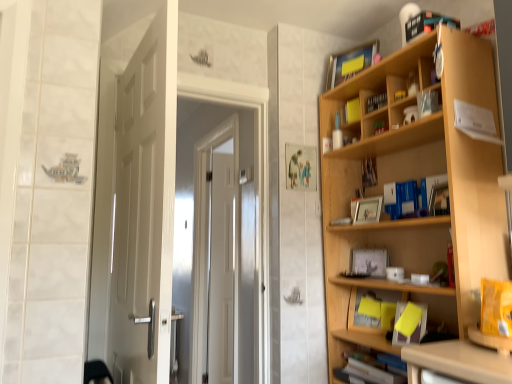
You are a GUI agent. You are given a task and a screenshot of the screen. Output one action in this format:
    pyautogui.click(x=<x>, y=<y>)
    Task: Click on the yellow paper at lower right, marked as the first book in a bottom-to-top arrangement
    
    Given the screenshot: What is the action you would take?
    pyautogui.click(x=373, y=311)

Image resolution: width=512 pixels, height=384 pixels. What do you see at coordinates (496, 307) in the screenshot?
I see `yellow paper at lower right, the ninth book from the top` at bounding box center [496, 307].

Image resolution: width=512 pixels, height=384 pixels. Identify the location of matte yellow book at upper right, the second book viewed from the top. (350, 63).

In order to face matte plastic book at upper right, which appears as the sixth book when ordered from the bottom, should I rotate leftwards or rightwards?

You should look right and rotate roughly 22.225 degrees.

Find the location of a particular element. Image resolution: width=512 pixels, height=384 pixels. yellow matte bookshelf at upper center, arranged as the 7th book when ordered from the bottom is located at coordinates (352, 110).

What do you see at coordinates (369, 172) in the screenshot? I see `wooden photo frame at upper right, positioned as the 8th book in top-to-bottom order` at bounding box center [369, 172].

Where is `wooden photo frame at upper right, positioned as the 8th book in top-to-bottom order`? wooden photo frame at upper right, positioned as the 8th book in top-to-bottom order is located at coordinates (369, 172).

Identify the location of yellow paper at lower right, marked as the first book in a bottom-to-top arrangement. The width and height of the screenshot is (512, 384). (373, 311).

From the image's perspective, would you say yellow matte bookshelf at upper center, arranged as the 7th book when ordered from the bottom, is positioned over green matte bookshelf at upper center, marked as the 5th book in a bottom-to-top arrangement?

Correct, yellow matte bookshelf at upper center, arranged as the 7th book when ordered from the bottom, appears higher than green matte bookshelf at upper center, marked as the 5th book in a bottom-to-top arrangement, in the image.

From the picture: Who is bigger, yellow matte bookshelf at upper center, arranged as the 7th book when ordered from the bottom, or green matte bookshelf at upper center, placed as the sixth book when sorted from top to bottom?

yellow matte bookshelf at upper center, arranged as the 7th book when ordered from the bottom.

Is yellow matte bookshelf at upper center, the fourth book when ordered from top to bottom, inside or outside of green matte bookshelf at upper center, marked as the 5th book in a bottom-to-top arrangement?

yellow matte bookshelf at upper center, the fourth book when ordered from top to bottom, is located beyond the bounds of green matte bookshelf at upper center, marked as the 5th book in a bottom-to-top arrangement.

How different are the orientations of yellow matte bookshelf at upper center, the fourth book when ordered from top to bottom, and green matte bookshelf at upper center, placed as the sixth book when sorted from top to bottom, in degrees?

17.7 degrees separate the facing orientations of yellow matte bookshelf at upper center, the fourth book when ordered from top to bottom, and green matte bookshelf at upper center, placed as the sixth book when sorted from top to bottom.

Which point is more forward, (437, 91) or (341, 341)?

The point (437, 91) is more forward.

Consider the image. From a real-world perspective, who is located higher, matte plastic book at upper right, arranged as the fifth book when viewed from the top, or light wood bookcase at right?

matte plastic book at upper right, arranged as the fifth book when viewed from the top, from a real-world perspective.

Based on their sizes in the image, would you say matte plastic book at upper right, arranged as the fifth book when viewed from the top, is bigger or smaller than light wood bookcase at right?

Clearly, matte plastic book at upper right, arranged as the fifth book when viewed from the top, is smaller in size than light wood bookcase at right.

Measure the distance from matte plastic book at upper right, arranged as the fifth book when viewed from the top, to light wood bookcase at right.

They are 18.93 inches apart.

How many degrees apart are the facing directions of yellow paper at lower right, marked as the first book in a bottom-to-top arrangement, and yellow matte bookshelf at upper center, arranged as the 7th book when ordered from the bottom?

5.61 degrees separate the facing orientations of yellow paper at lower right, marked as the first book in a bottom-to-top arrangement, and yellow matte bookshelf at upper center, arranged as the 7th book when ordered from the bottom.

From the picture: Considering the sizes of objects yellow paper at lower right, marked as the first book in a bottom-to-top arrangement, and yellow matte bookshelf at upper center, the fourth book when ordered from top to bottom, in the image provided, who is shorter, yellow paper at lower right, marked as the first book in a bottom-to-top arrangement, or yellow matte bookshelf at upper center, the fourth book when ordered from top to bottom,?

yellow matte bookshelf at upper center, the fourth book when ordered from top to bottom, is shorter.

From the picture: Which is farther, (378, 308) or (351, 116)?

Point (351, 116)

Is yellow paper at lower right, which is the tenth book in top-to-bottom order, touching yellow matte bookshelf at upper center, arranged as the 7th book when ordered from the bottom?

yellow paper at lower right, which is the tenth book in top-to-bottom order, and yellow matte bookshelf at upper center, arranged as the 7th book when ordered from the bottom, are not in contact.

Considering the sizes of objects green matte bookshelf at upper center, marked as the 5th book in a bottom-to-top arrangement, and matte yellow book at upper right, positioned as the 9th book in bottom-to-top order, in the image provided, who is wider, green matte bookshelf at upper center, marked as the 5th book in a bottom-to-top arrangement, or matte yellow book at upper right, positioned as the 9th book in bottom-to-top order,?

matte yellow book at upper right, positioned as the 9th book in bottom-to-top order, is wider.

Consider the image. Who is taller, green matte bookshelf at upper center, marked as the 5th book in a bottom-to-top arrangement, or matte yellow book at upper right, positioned as the 9th book in bottom-to-top order?

Standing taller between the two is matte yellow book at upper right, positioned as the 9th book in bottom-to-top order.

Is matte yellow book at upper right, positioned as the 9th book in bottom-to-top order, surrounded by green matte bookshelf at upper center, marked as the 5th book in a bottom-to-top arrangement?

No, matte yellow book at upper right, positioned as the 9th book in bottom-to-top order, is not inside green matte bookshelf at upper center, marked as the 5th book in a bottom-to-top arrangement.

From the picture: Looking at the image, does green matte bookshelf at upper center, placed as the sixth book when sorted from top to bottom, seem bigger or smaller compared to matte yellow book at upper right, positioned as the 9th book in bottom-to-top order?

Clearly, green matte bookshelf at upper center, placed as the sixth book when sorted from top to bottom, is smaller in size than matte yellow book at upper right, positioned as the 9th book in bottom-to-top order.

Is light wood bookcase at right at the back of matte yellow book at upper right, the second book viewed from the top?

No, matte yellow book at upper right, the second book viewed from the top, is not facing the opposite direction of light wood bookcase at right.

Based on the photo, between matte yellow book at upper right, positioned as the 9th book in bottom-to-top order, and light wood bookcase at right, which one appears on the left side from the viewer's perspective?

matte yellow book at upper right, positioned as the 9th book in bottom-to-top order.

Can you confirm if matte yellow book at upper right, the second book viewed from the top, is taller than light wood bookcase at right?

Incorrect, the height of matte yellow book at upper right, the second book viewed from the top, is not larger of that of light wood bookcase at right.

Considering the relative sizes of matte yellow book at upper right, the second book viewed from the top, and light wood bookcase at right in the image provided, is matte yellow book at upper right, the second book viewed from the top, thinner than light wood bookcase at right?

Yes.

From the image's perspective, is black matte bookshelf at upper center, the 3th book in the top-to-bottom sequence, positioned above or below black matte book at upper right, acting as the first book starting from the top?

Based on their image positions, black matte bookshelf at upper center, the 3th book in the top-to-bottom sequence, is located beneath black matte book at upper right, acting as the first book starting from the top.

Is black matte bookshelf at upper center, the 3th book in the top-to-bottom sequence, outside of black matte book at upper right, acting as the first book starting from the top?

Yes, black matte bookshelf at upper center, the 3th book in the top-to-bottom sequence, is not within black matte book at upper right, acting as the first book starting from the top.

Considering the relative sizes of yellow paper at lower right, which is the tenth book in top-to-bottom order, and black matte bookshelf at upper center, which is the eighth book from bottom to top, in the image provided, is yellow paper at lower right, which is the tenth book in top-to-bottom order, bigger than black matte bookshelf at upper center, which is the eighth book from bottom to top,?

Indeed, yellow paper at lower right, which is the tenth book in top-to-bottom order, has a larger size compared to black matte bookshelf at upper center, which is the eighth book from bottom to top.

Find the location of a particular element. This screenshot has width=512, height=384. the 7th book above when counting from the yellow paper at lower right, marked as the first book in a bottom-to-top arrangement (from the image's perspective) is located at coordinates (376, 102).

Is there a large distance between yellow paper at lower right, which is the tenth book in top-to-bottom order, and black matte bookshelf at upper center, the 3th book in the top-to-bottom sequence?

No, yellow paper at lower right, which is the tenth book in top-to-bottom order, is in close proximity to black matte bookshelf at upper center, the 3th book in the top-to-bottom sequence.

Can you tell me how much yellow paper at lower right, marked as the first book in a bottom-to-top arrangement, and black matte bookshelf at upper center, which is the eighth book from bottom to top, differ in facing direction?

8.86 degrees separate the facing orientations of yellow paper at lower right, marked as the first book in a bottom-to-top arrangement, and black matte bookshelf at upper center, which is the eighth book from bottom to top.

Identify the location of book that is the 2nd one when counting upward from the green matte bookshelf at upper center, marked as the 5th book in a bottom-to-top arrangement (from the image's perspective). (352, 110).

Find the location of a particular element. book that is the 3rd one when counting backward from the light wood bookcase at right is located at coordinates (426, 103).

From the image, which object appears to be nearer to black matte bookshelf at upper center, which is the eighth book from bottom to top, yellow matte bookshelf at upper center, the fourth book when ordered from top to bottom, or yellow paper at lower right, which is the tenth book in top-to-bottom order?

yellow matte bookshelf at upper center, the fourth book when ordered from top to bottom.

Looking at the image, which one is located further to matte yellow book at upper right, positioned as the 9th book in bottom-to-top order, yellow paper at lower right, which is the 2th book from bottom to top, or light wood bookcase at right?

yellow paper at lower right, which is the 2th book from bottom to top.

Based on their spatial positions, is white glossy door at left or black matte bookshelf at upper center, the 3th book in the top-to-bottom sequence, further from matte plastic book at upper right, arranged as the fifth book when viewed from the top?

Based on the image, white glossy door at left appears to be further to matte plastic book at upper right, arranged as the fifth book when viewed from the top.

When comparing their distances from white paper at upper right, which is the fourth book from bottom to top, does black matte bookshelf at upper center, which is the eighth book from bottom to top, or yellow matte bookshelf at upper center, arranged as the 7th book when ordered from the bottom, seem further?

Based on the image, yellow matte bookshelf at upper center, arranged as the 7th book when ordered from the bottom, appears to be further to white paper at upper right, which is the fourth book from bottom to top.

When comparing their distances from black matte bookshelf at upper center, the 3th book in the top-to-bottom sequence, does wooden photo frame at upper right, arranged as the 3th book when ordered from the bottom, or light wood bookcase at right seem further?

light wood bookcase at right lies further to black matte bookshelf at upper center, the 3th book in the top-to-bottom sequence, than the other object.

Based on their spatial positions, is white paper at upper right, which is the fourth book from bottom to top, or yellow paper at lower right, marked as the first book in a bottom-to-top arrangement, further from light wood bookcase at right?

yellow paper at lower right, marked as the first book in a bottom-to-top arrangement, is positioned further to the anchor light wood bookcase at right.

Estimate the real-world distances between objects in this image. Which object is further from matte yellow book at upper right, the second book viewed from the top, black matte book at upper right, placed as the 10th book when sorted from bottom to top, or white glossy door at left?

Based on the image, white glossy door at left appears to be further to matte yellow book at upper right, the second book viewed from the top.

From the image, which object appears to be nearer to white glossy door at center, black matte bookshelf at upper center, the 3th book in the top-to-bottom sequence, or white glossy door at left?

white glossy door at left is positioned closer to the anchor white glossy door at center.

You are a GUI agent. You are given a task and a screenshot of the screen. Output one action in this format:
    pyautogui.click(x=<x>, y=<y>)
    Task: Click on the door between matte yellow book at upper right, positioned as the 9th book in bottom-to-top order, and yellow paper at lower right, marked as the first book in a bottom-to-top arrangement, in the vertical direction
    This screenshot has width=512, height=384.
    Given the screenshot: What is the action you would take?
    pyautogui.click(x=136, y=209)

I want to click on bookcase that lies between black matte book at upper right, placed as the 10th book when sorted from bottom to top, and yellow paper at lower right, which is the 2th book from bottom to top, from top to bottom, so click(414, 179).

The height and width of the screenshot is (384, 512). I want to click on bookcase between white glossy door at left and matte plastic book at upper right, which appears as the sixth book when ordered from the bottom, so click(x=414, y=179).

Identify the location of bookcase between yellow paper at lower right, which is the 2th book from bottom to top, and white glossy door at center from front to back. This screenshot has height=384, width=512. (414, 179).